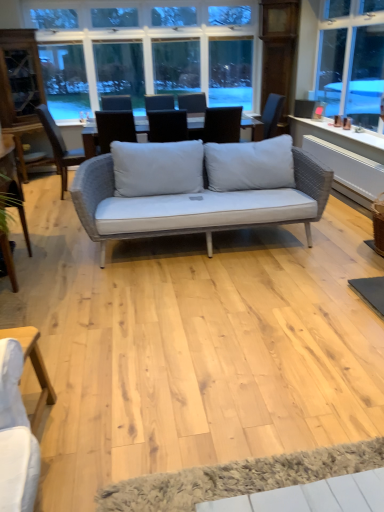
The width and height of the screenshot is (384, 512). In order to click on vacant space that is to the left of white textured yoga mat at lower center in this screenshot , I will do `click(122, 432)`.